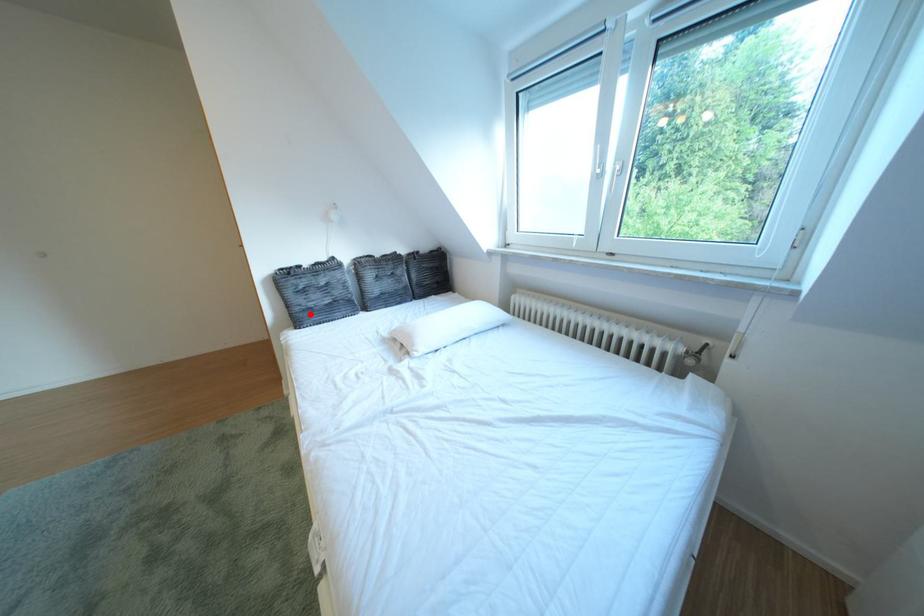
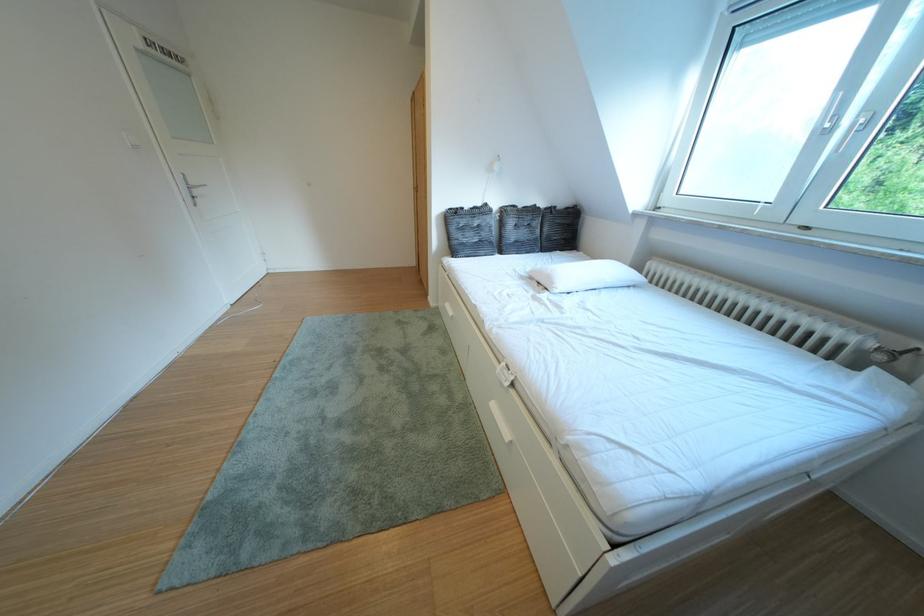
Where in the second image is the point corresponding to the highlighted location from the first image?

(468, 246)